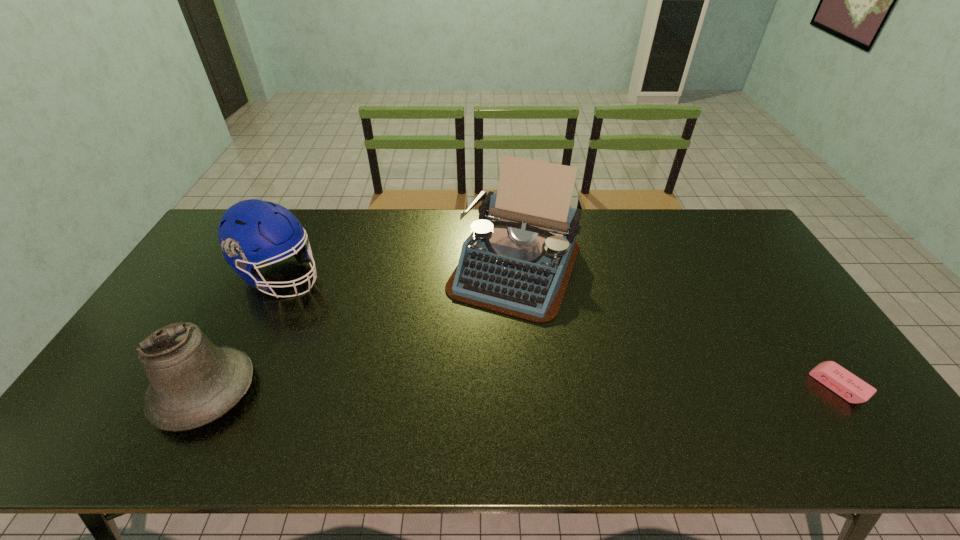
Locate an element on the screen. The width and height of the screenshot is (960, 540). free space at the far edge is located at coordinates (464, 221).

The image size is (960, 540). What are the coordinates of `free space at the near edge of the desktop` in the screenshot? It's located at (703, 389).

You are a GUI agent. You are given a task and a screenshot of the screen. Output one action in this format:
    pyautogui.click(x=<x>, y=<y>)
    Task: Click on the vacant space at the right edge of the desktop
    The width and height of the screenshot is (960, 540).
    Given the screenshot: What is the action you would take?
    pyautogui.click(x=803, y=320)

Where is `free space at the near left corner of the desktop`? Image resolution: width=960 pixels, height=540 pixels. free space at the near left corner of the desktop is located at coordinates pos(137,404).

Locate an element on the screen. free space at the far right corner of the desktop is located at coordinates (x=717, y=237).

Locate an element on the screen. free area in between the football helmet and the bell is located at coordinates (243, 333).

Locate an element on the screen. The image size is (960, 540). vacant space in between the football helmet and the shortest object is located at coordinates (560, 330).

Locate an element on the screen. free space between the football helmet and the bell is located at coordinates (243, 333).

At what (x,y) coordinates should I click in order to perform the action: click on empty space that is in between the bell and the typewriter. Please return your answer as a coordinate pair (x, y). This screenshot has height=540, width=960. Looking at the image, I should click on tap(360, 329).

Where is `vacant space in between the rightmost object and the bell`? Image resolution: width=960 pixels, height=540 pixels. vacant space in between the rightmost object and the bell is located at coordinates (521, 389).